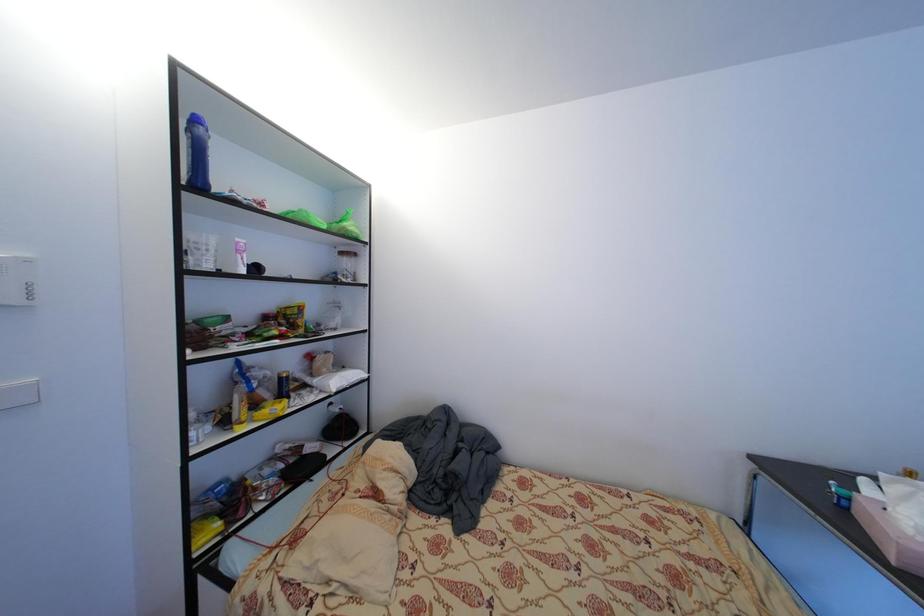
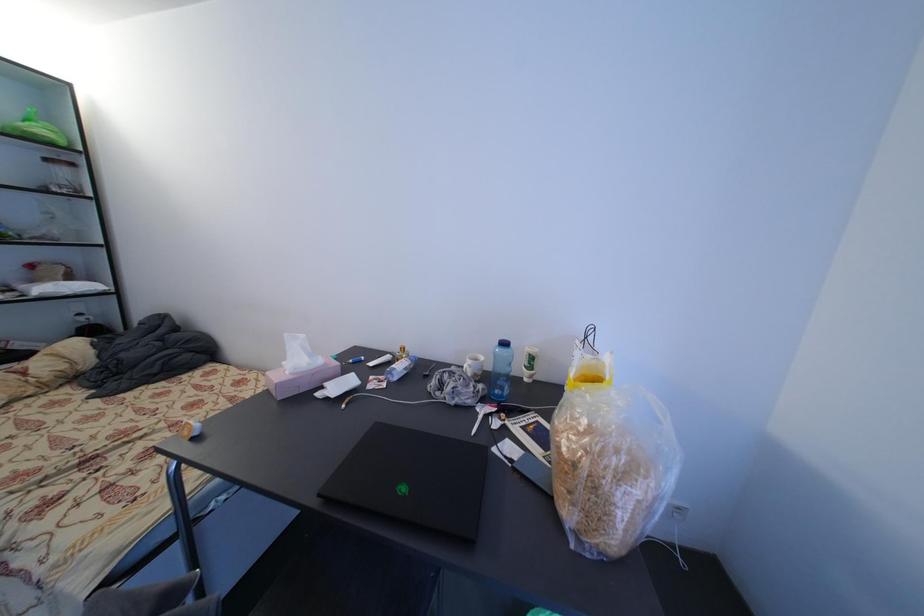
Question: What movement of the cameraman would produce the second image?

Choices:
 (A) Left
 (B) Right
 (C) Forward
 (D) Backward

Answer: (B)